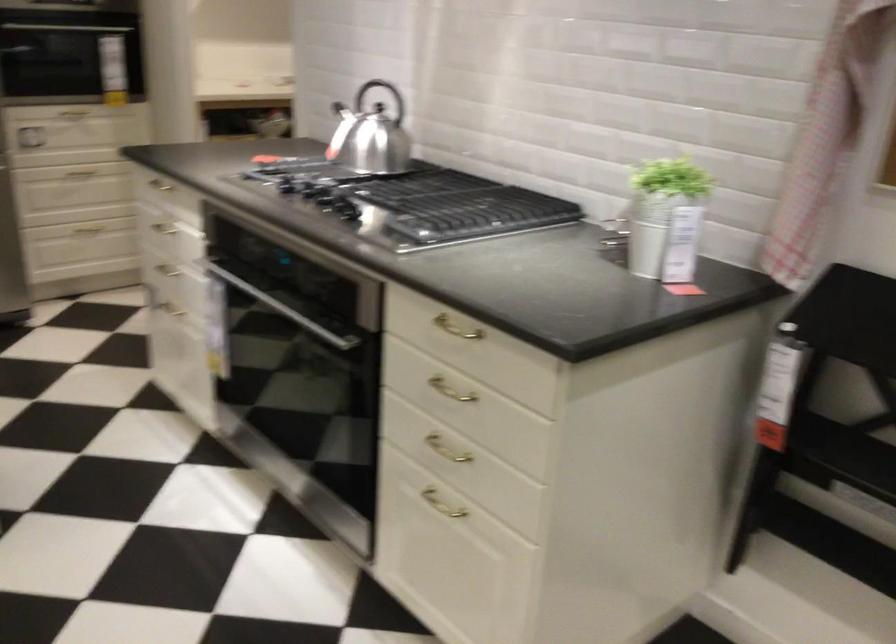
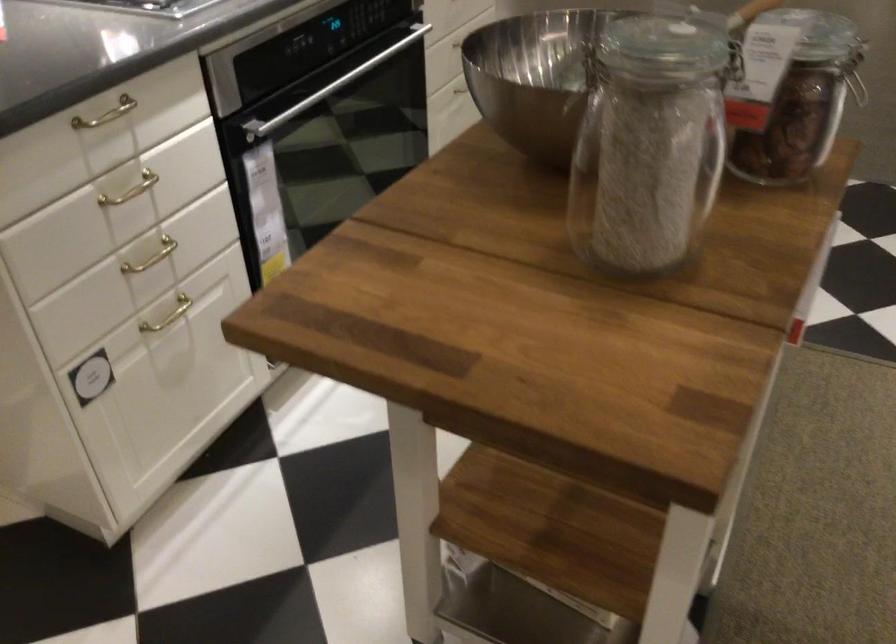
The point at (168, 222) is marked in the first image. Where is the corresponding point in the second image?

(131, 190)